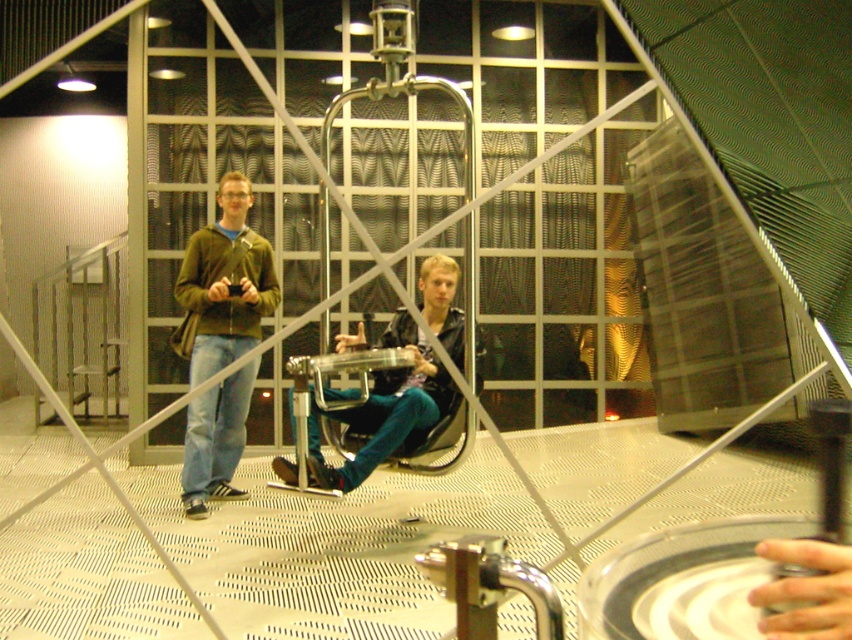
Is blue denim jeans at left to the right of blue denim jeans at center from the viewer's perspective?

In fact, blue denim jeans at left is to the left of blue denim jeans at center.

Is point (228, 348) farther from camera compared to point (389, 410)?

Yes, point (228, 348) is farther from viewer.

In order to click on blue denim jeans at left in this screenshot , I will do `click(216, 436)`.

Is teal denim jeans at center taller than blue denim jeans at left?

Indeed, teal denim jeans at center has a greater height compared to blue denim jeans at left.

Does teal denim jeans at center appear under blue denim jeans at left?

No, teal denim jeans at center is not below blue denim jeans at left.

Is point (355, 412) behind point (203, 456)?

No, (355, 412) is in front of (203, 456).

Identify the location of teal denim jeans at center. (384, 408).

Between green matte jacket at left and teal denim jeans at center, which one appears on the left side from the viewer's perspective?

green matte jacket at left is more to the left.

Is green matte jacket at left taller than teal denim jeans at center?

Correct, green matte jacket at left is much taller as teal denim jeans at center.

Which is behind, point (258, 241) or point (407, 416)?

The point (258, 241) is behind.

At what (x,y) coordinates should I click in order to perform the action: click on green matte jacket at left. Please return your answer as a coordinate pair (x, y). Looking at the image, I should click on (223, 285).